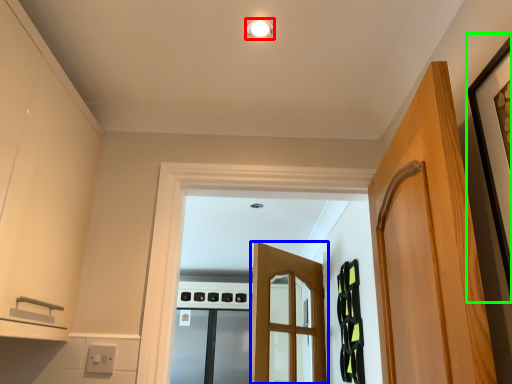
Question: Which object is positioned closest to light fixture (highlighted by a red box)? Select from door (highlighted by a blue box) and picture frame (highlighted by a green box).

Choices:
 (A) door
 (B) picture frame

Answer: (B)